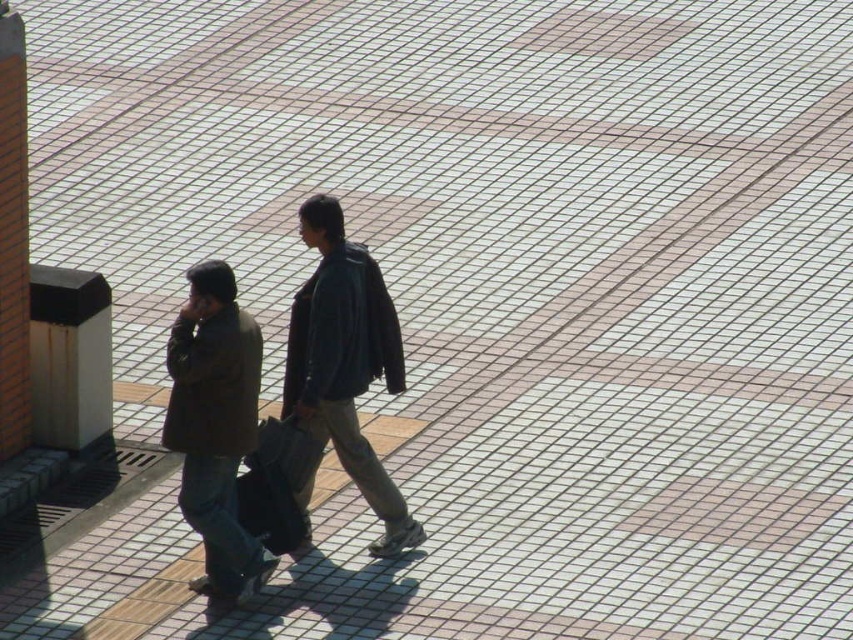
Can you confirm if dark blue leather jacket at center is bigger than brown matte jacket at center?

Yes, dark blue leather jacket at center is bigger than brown matte jacket at center.

At what (x,y) coordinates should I click in order to perform the action: click on dark blue leather jacket at center. Please return your answer as a coordinate pair (x, y). The width and height of the screenshot is (853, 640). Looking at the image, I should click on (344, 365).

What are the coordinates of `dark blue leather jacket at center` in the screenshot? It's located at (344, 365).

Who is positioned more to the right, dark brown leather jacket at center or dark blue leather jacket at center?

Positioned to the right is dark blue leather jacket at center.

The height and width of the screenshot is (640, 853). What do you see at coordinates (343, 365) in the screenshot? I see `dark brown leather jacket at center` at bounding box center [343, 365].

This screenshot has width=853, height=640. What do you see at coordinates (343, 365) in the screenshot? I see `dark brown leather jacket at center` at bounding box center [343, 365].

You are a GUI agent. You are given a task and a screenshot of the screen. Output one action in this format:
    pyautogui.click(x=<x>, y=<y>)
    Task: Click on the dark brown leather jacket at center
    The image size is (853, 640).
    Given the screenshot: What is the action you would take?
    pyautogui.click(x=343, y=365)

At what (x,y) coordinates should I click in order to perform the action: click on dark brown leather jacket at center. Please return your answer as a coordinate pair (x, y). This screenshot has height=640, width=853. Looking at the image, I should click on (343, 365).

Who is more distant from viewer, [219,436] or [262,560]?

Positioned behind is point [262,560].

Locate an element on the screen. Image resolution: width=853 pixels, height=640 pixels. dark brown leather jacket at center is located at coordinates (343, 365).